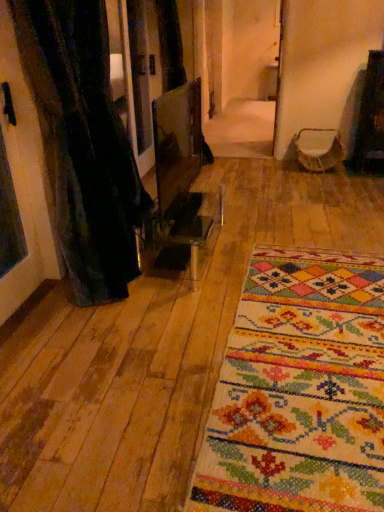
Question: Relative to black textured curtain at left, is velvet-like beige armchair at center in front or behind?

Choices:
 (A) front
 (B) behind

Answer: (B)

Question: In terms of width, does velvet-like beige armchair at center look wider or thinner when compared to black textured curtain at left?

Choices:
 (A) wide
 (B) thin

Answer: (A)

Question: Which object is the farthest from the black textured curtain at left?

Choices:
 (A) velvet-like beige armchair at center
 (B) multicolored woven rug at center

Answer: (A)

Question: Based on their relative distances, which object is farther from the multicolored woven rug at center?

Choices:
 (A) velvet-like beige armchair at center
 (B) black textured curtain at left

Answer: (A)